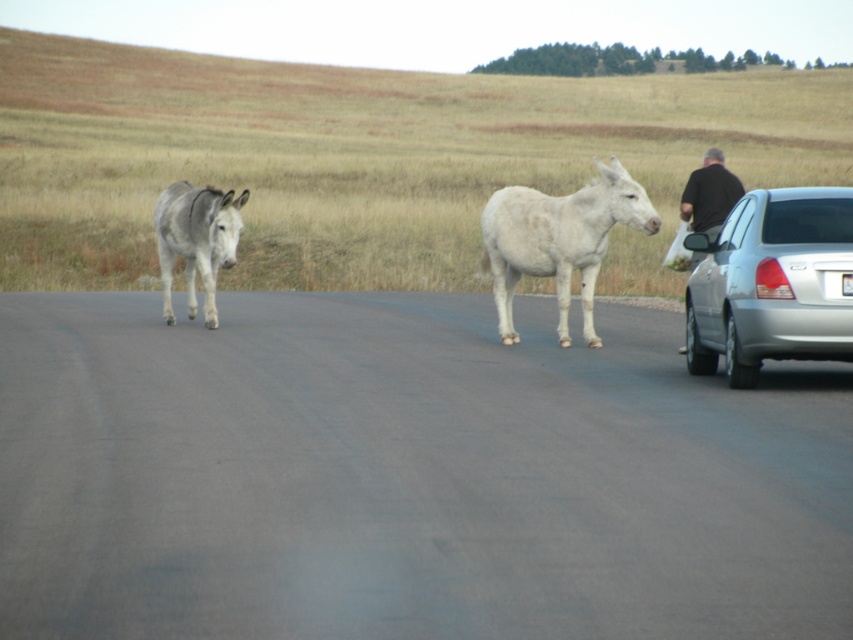
Is the position of silver metallic sedan at right more distant than that of white matte donkey at center?

No, it is not.

Can you confirm if silver metallic sedan at right is positioned below white matte donkey at center?

Yes, silver metallic sedan at right is below white matte donkey at center.

Does point (695, 317) come behind point (503, 332)?

No, it is not.

Image resolution: width=853 pixels, height=640 pixels. Find the location of `silver metallic sedan at right`. silver metallic sedan at right is located at coordinates (772, 284).

Is white matte donkey at center below gray matte donkey at left?

Incorrect, white matte donkey at center is not positioned below gray matte donkey at left.

Is white matte donkey at center above gray matte donkey at left?

Indeed, white matte donkey at center is positioned over gray matte donkey at left.

Where is `white matte donkey at center`? white matte donkey at center is located at coordinates (558, 241).

Image resolution: width=853 pixels, height=640 pixels. I want to click on white matte donkey at center, so 558,241.

Looking at this image, can you confirm if white matte donkey at center is shorter than black fabric at right?

Indeed, white matte donkey at center has a lesser height compared to black fabric at right.

Can you confirm if white matte donkey at center is positioned above black fabric at right?

Incorrect, white matte donkey at center is not positioned above black fabric at right.

Is point (643, 211) positioned behind point (724, 186)?

No, it is not.

Locate an element on the screen. Image resolution: width=853 pixels, height=640 pixels. white matte donkey at center is located at coordinates (558, 241).